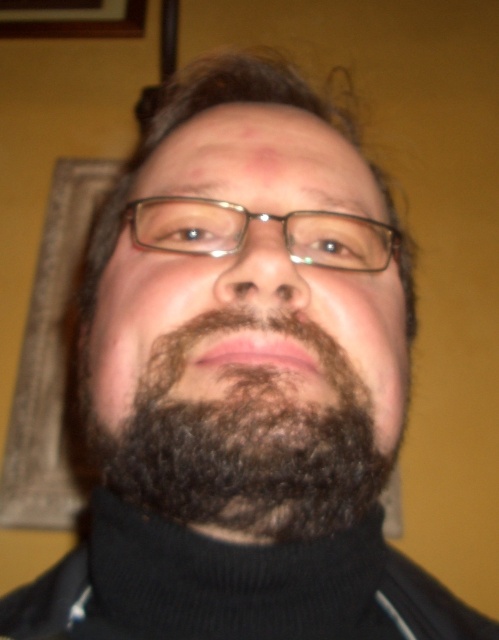
Between dark brown curly beard at center and black knitted polo neck at center, which one has less height?

black knitted polo neck at center is shorter.

Consider the image. Is dark brown curly beard at center positioned in front of black knitted polo neck at center?

Yes, dark brown curly beard at center is in front of black knitted polo neck at center.

Measure the distance between point (200, 404) and camera.

The distance of point (200, 404) from camera is 12.78 inches.

Find the location of a particular element. The width and height of the screenshot is (499, 640). dark brown curly beard at center is located at coordinates (247, 440).

Locate an element on the screen. Image resolution: width=499 pixels, height=640 pixels. dark brown curly beard at center is located at coordinates (247, 440).

Is dark brown curly beard at center in front of clear plastic glasses at center?

Yes.

Which is in front, point (267, 392) or point (306, 234)?

Point (267, 392) is more forward.

Locate an element on the screen. Image resolution: width=499 pixels, height=640 pixels. dark brown curly beard at center is located at coordinates (247, 440).

Which of these two, black knitted polo neck at center or clear plastic glasses at center, stands shorter?

With less height is clear plastic glasses at center.

Is point (133, 518) farther from viewer compared to point (164, 204)?

No, it is not.

The image size is (499, 640). I want to click on black knitted polo neck at center, so click(228, 580).

Image resolution: width=499 pixels, height=640 pixels. Find the location of `black knitted polo neck at center`. black knitted polo neck at center is located at coordinates (228, 580).